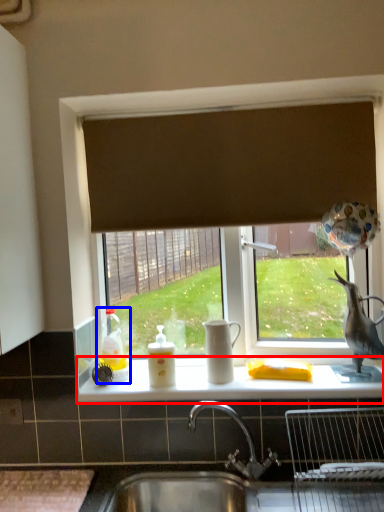
Question: Which point is further to the camera, counter top (highlighted by a red box) or toy (highlighted by a blue box)?

Choices:
 (A) counter top
 (B) toy

Answer: (B)